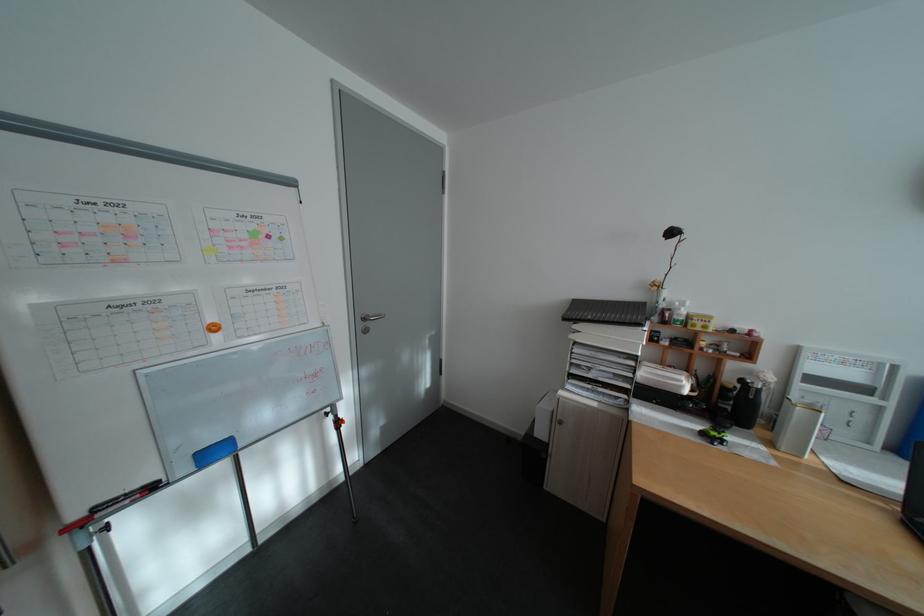
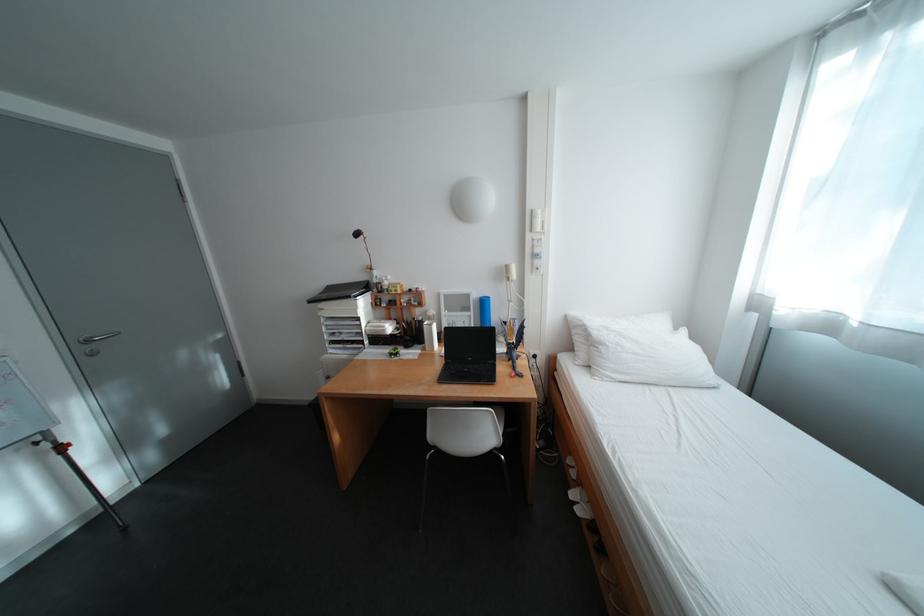
In the second image, find the point that corresponds to the point at 763,398 in the first image.

(430, 326)